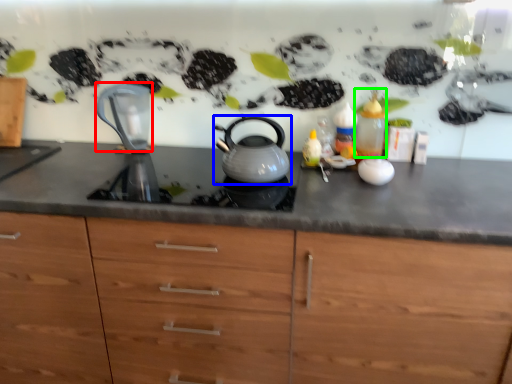
Question: Considering the real-world distances, which object is closest to jug (highlighted by a red box)? kettle (highlighted by a blue box) or bottle (highlighted by a green box).

Choices:
 (A) kettle
 (B) bottle

Answer: (A)